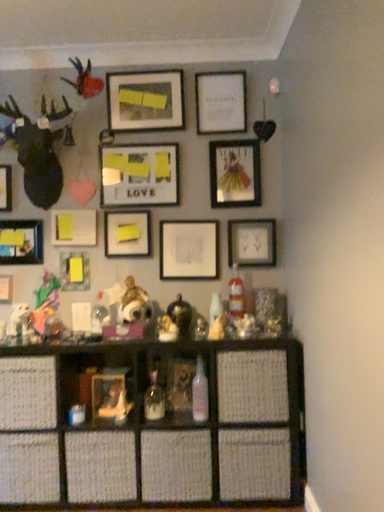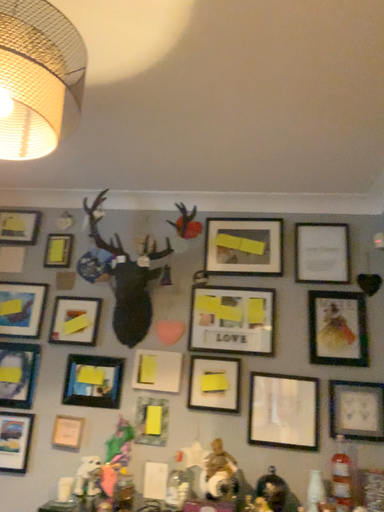
Question: Which way did the camera rotate in the video?

Choices:
 (A) rotated upward
 (B) rotated downward

Answer: (A)